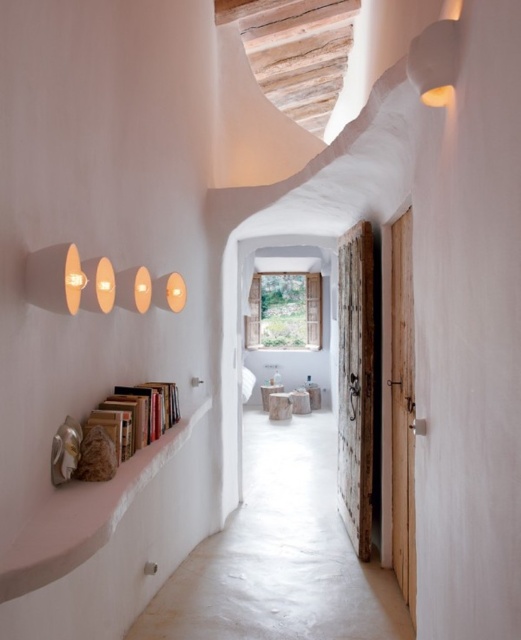
The height and width of the screenshot is (640, 521). Find the location of `white stucco ledge at lower left`. white stucco ledge at lower left is located at coordinates pos(84,515).

Can you confirm if white stucco ledge at lower left is positioned to the left of wooden bookshelf at left?

No, white stucco ledge at lower left is not to the left of wooden bookshelf at left.

Find the location of `white stucco ledge at lower left`. white stucco ledge at lower left is located at coordinates (84, 515).

At what (x,y) coordinates should I click in order to perform the action: click on white stucco ledge at lower left. Please return your answer as a coordinate pair (x, y). Image resolution: width=521 pixels, height=640 pixels. Looking at the image, I should click on (84, 515).